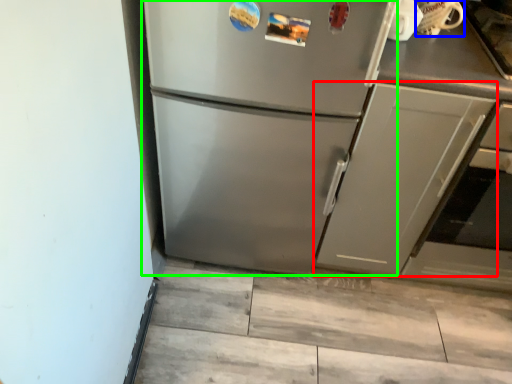
Question: Based on their relative distances, which object is farther from cabinetry (highlighted by a red box)? Choose from appliance (highlighted by a blue box) and refrigerator (highlighted by a green box).

Choices:
 (A) appliance
 (B) refrigerator

Answer: (A)